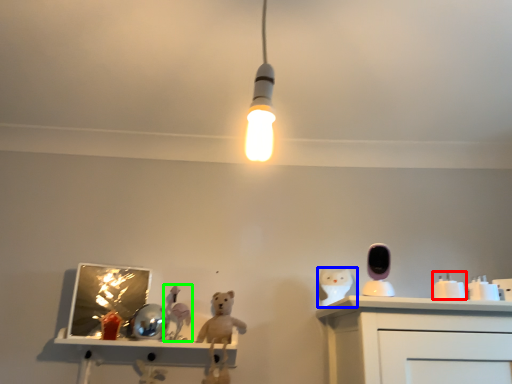
Question: Which object is the farthest from toy (highlighted by a red box)? Choose among these: animal (highlighted by a blue box) or toy (highlighted by a green box).

Choices:
 (A) animal
 (B) toy

Answer: (B)